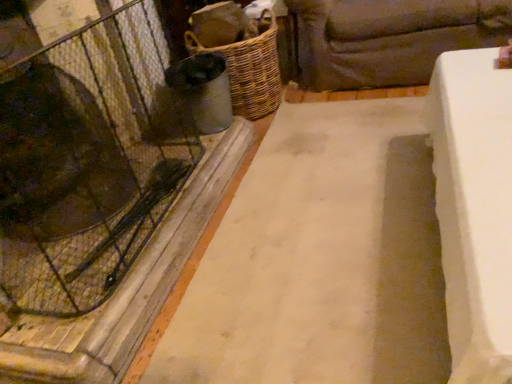
Question: Is white concrete slab at center completely or partially outside of transparent glass door at left?

Choices:
 (A) yes
 (B) no

Answer: (A)

Question: Can you confirm if white concrete slab at center is bigger than transparent glass door at left?

Choices:
 (A) yes
 (B) no

Answer: (A)

Question: From the image's perspective, is white concrete slab at center on top of transparent glass door at left?

Choices:
 (A) no
 (B) yes

Answer: (B)

Question: Considering the relative sizes of white concrete slab at center and transparent glass door at left in the image provided, is white concrete slab at center thinner than transparent glass door at left?

Choices:
 (A) yes
 (B) no

Answer: (B)

Question: From a real-world perspective, is white concrete slab at center on transparent glass door at left?

Choices:
 (A) no
 (B) yes

Answer: (A)

Question: Can transparent glass door at left be found inside white concrete slab at center?

Choices:
 (A) yes
 (B) no

Answer: (B)

Question: From the image's perspective, is woven brown basket at center-left above dark brown fabric couch at upper right?

Choices:
 (A) yes
 (B) no

Answer: (B)

Question: From the image's perspective, is woven brown basket at center-left beneath dark brown fabric couch at upper right?

Choices:
 (A) no
 (B) yes

Answer: (B)

Question: Would you consider woven brown basket at center-left to be distant from dark brown fabric couch at upper right?

Choices:
 (A) yes
 (B) no

Answer: (B)

Question: From a real-world perspective, is woven brown basket at center-left under dark brown fabric couch at upper right?

Choices:
 (A) no
 (B) yes

Answer: (A)

Question: Considering the relative sizes of woven brown basket at center-left and dark brown fabric couch at upper right in the image provided, is woven brown basket at center-left bigger than dark brown fabric couch at upper right?

Choices:
 (A) no
 (B) yes

Answer: (A)

Question: Does woven brown basket at center-left have a lesser height compared to dark brown fabric couch at upper right?

Choices:
 (A) no
 (B) yes

Answer: (A)

Question: From a real-world perspective, is transparent glass door at left over white concrete slab at center?

Choices:
 (A) no
 (B) yes

Answer: (B)